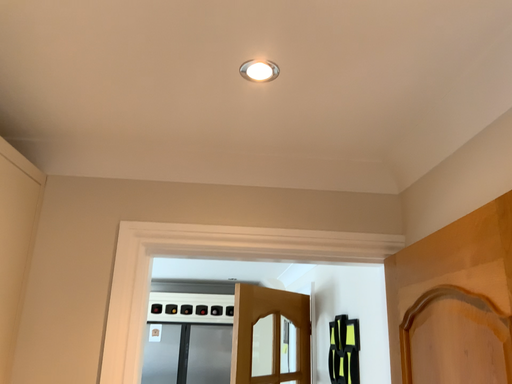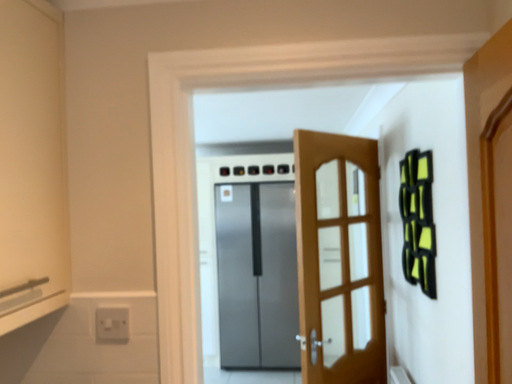
Question: Which way did the camera rotate in the video?

Choices:
 (A) rotated right
 (B) rotated left

Answer: (B)